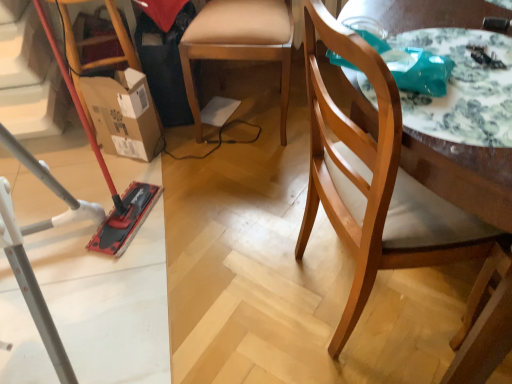
You are a GUI agent. You are given a task and a screenshot of the screen. Output one action in this format:
    pyautogui.click(x=<x>, y=<y>)
    Task: Click on the free spot above white glossy table at upper right (from a real-world perspective)
    This screenshot has height=384, width=512.
    Given the screenshot: What is the action you would take?
    pyautogui.click(x=463, y=73)